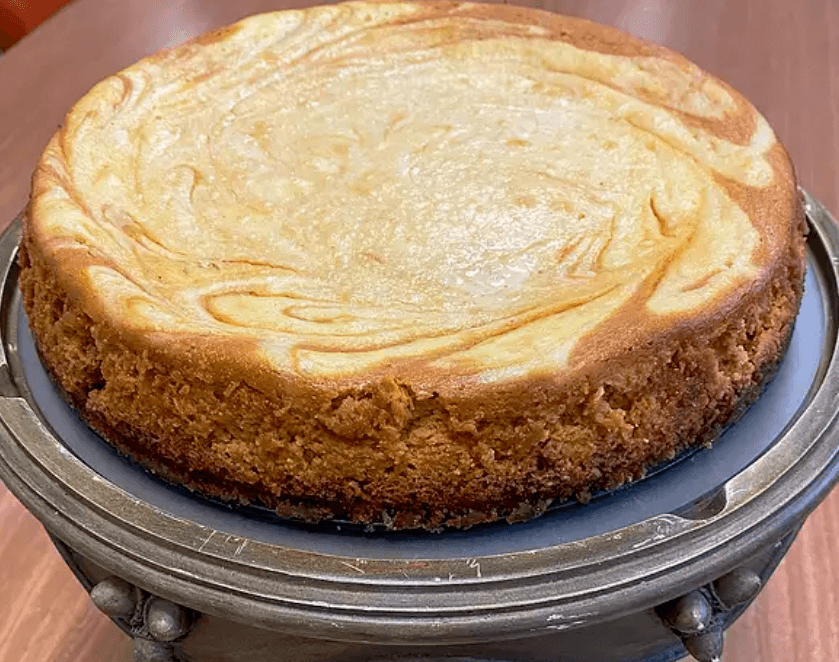
The height and width of the screenshot is (662, 839). What are the coordinates of `white scatches on cake tray` in the screenshot? It's located at (478, 563), (242, 544), (204, 537), (360, 565), (556, 623), (650, 535), (665, 518), (105, 481), (61, 441), (13, 252).